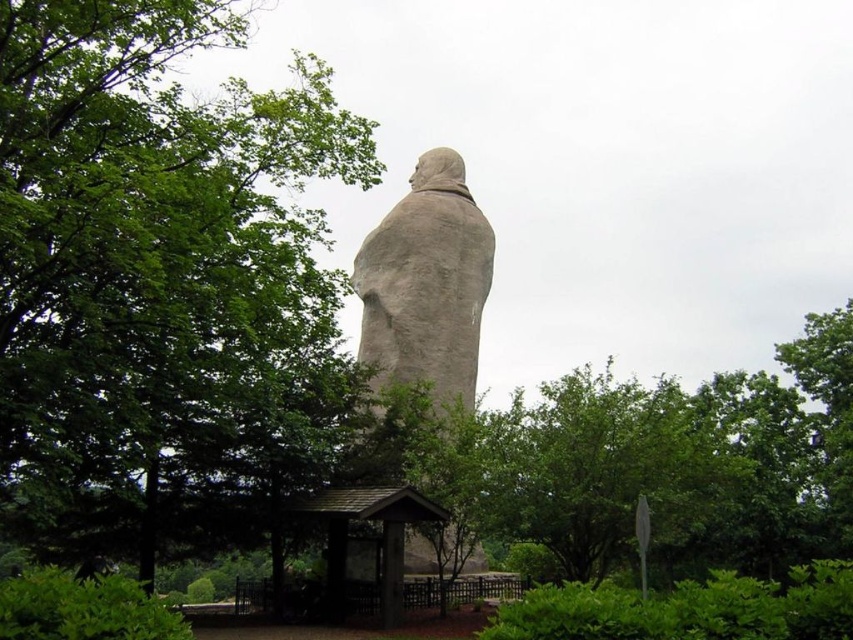
Between point (38, 276) and point (345, 579), which one is positioned in front?

Point (38, 276) is more forward.

Which is in front, point (113, 61) or point (343, 492)?

Positioned in front is point (113, 61).

Image resolution: width=853 pixels, height=640 pixels. I want to click on green leafy tree at left, so click(144, 240).

Who is lower down, gray stone statue at center or brown wooden shelter at lower center?

brown wooden shelter at lower center is below.

Image resolution: width=853 pixels, height=640 pixels. What do you see at coordinates (426, 285) in the screenshot?
I see `gray stone statue at center` at bounding box center [426, 285].

The image size is (853, 640). In order to click on gray stone statue at center in this screenshot , I will do `click(426, 285)`.

Image resolution: width=853 pixels, height=640 pixels. I want to click on gray stone statue at center, so click(426, 285).

Based on the photo, between green leafy tree at left and gray stone statue at center, which one appears on the right side from the viewer's perspective?

Positioned to the right is gray stone statue at center.

This screenshot has height=640, width=853. Describe the element at coordinates (144, 240) in the screenshot. I see `green leafy tree at left` at that location.

Does point (177, 419) lie in front of point (467, 381)?

Yes, point (177, 419) is in front of point (467, 381).

Where is `green leafy tree at left`? The height and width of the screenshot is (640, 853). green leafy tree at left is located at coordinates pyautogui.click(x=144, y=240).